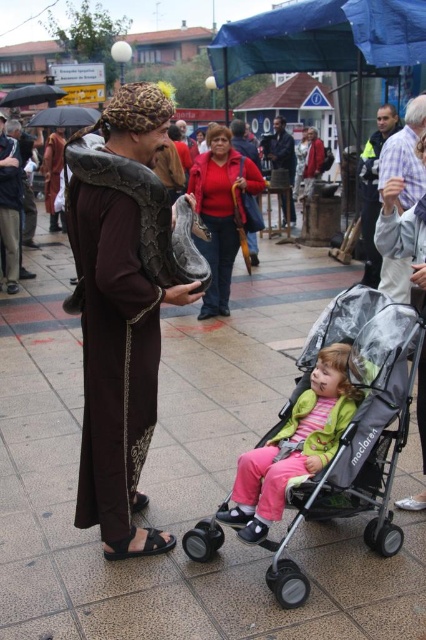
Question: Which object is the farthest from the matte red sweater at center?

Choices:
 (A) matte gray stroller at lower right
 (B) blue tarpaulin at upper center
 (C) pastel green fabric baby at lower center
 (D) matte brown robe at center

Answer: (B)

Question: Which object is positioned farthest from the blue tarpaulin at upper center?

Choices:
 (A) gray fabric baby carriage at lower center
 (B) brown tile pavement at center

Answer: (A)

Question: From the image, what is the correct spatial relationship of blue tarpaulin at upper center in relation to matte red sweater at center?

Choices:
 (A) above
 (B) below

Answer: (A)

Question: Is brown tile pavement at center above matte gray stroller at lower right?

Choices:
 (A) no
 (B) yes

Answer: (A)

Question: Can you confirm if blue tarpaulin at upper center is positioned below matte red sweater at center?

Choices:
 (A) yes
 (B) no

Answer: (B)

Question: Which point appears closest to the camera in this image?

Choices:
 (A) (271, 60)
 (B) (425, 349)
 (C) (209, 145)
 (D) (351, 448)

Answer: (D)